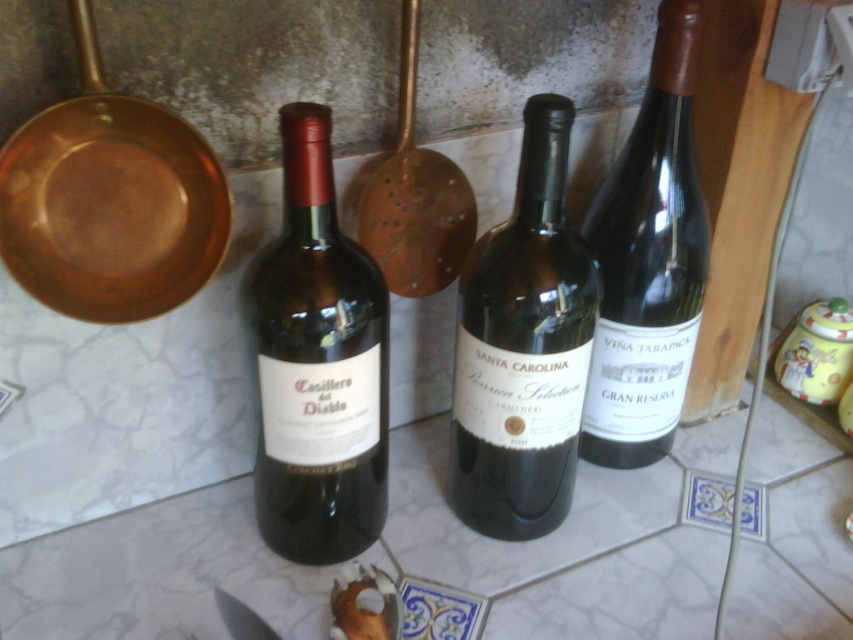
You are a chef preparing a dish and need to reach for the dark brown glass bottle at center and the matte silver knife at lower left. If your arm can extend 20 inches, can you comfortably reach both items without moving your position?

The dark brown glass bottle at center is 21.69 inches away from the matte silver knife at lower left. Since your arm can only extend 20 inches, you cannot comfortably reach both items without moving your position.

In the scene shown: You are standing in the kitchen and want to place a new bottle of white wine on the countertop. The new bottle is slightly taller than the matte dark brown bottle at center. Where should you place it to ensure it doesn not block the decorative blue tiles at the bottom right corner?

Place the new bottle of white wine to the left of the matte dark brown bottle at center, as the decorative blue tiles are at the bottom right corner and the new bottle is taller than the matte dark brown bottle at center, so placing it to the left would avoid blocking the tiles.